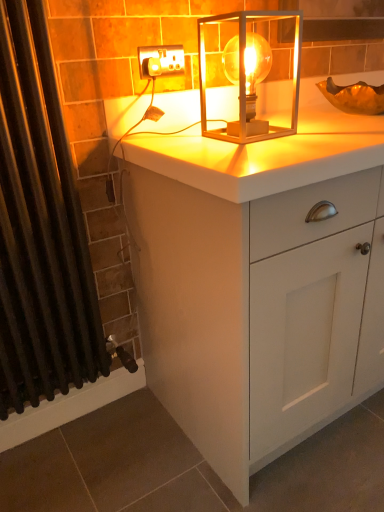
Question: Is white matte cabinet at center positioned beyond the bounds of white plastic socket at upper center?

Choices:
 (A) no
 (B) yes

Answer: (B)

Question: Considering the relative sizes of white matte cabinet at center and white plastic socket at upper center in the image provided, is white matte cabinet at center shorter than white plastic socket at upper center?

Choices:
 (A) yes
 (B) no

Answer: (B)

Question: Considering the relative sizes of white matte cabinet at center and white plastic socket at upper center in the image provided, is white matte cabinet at center wider than white plastic socket at upper center?

Choices:
 (A) yes
 (B) no

Answer: (A)

Question: Are white matte cabinet at center and white plastic socket at upper center located far from each other?

Choices:
 (A) yes
 (B) no

Answer: (B)

Question: From a real-world perspective, is white matte cabinet at center under white plastic socket at upper center?

Choices:
 (A) yes
 (B) no

Answer: (A)

Question: From the image's perspective, is white matte cabinet at center located above or below black fabric shower curtain at left?

Choices:
 (A) above
 (B) below

Answer: (B)

Question: In terms of size, does white matte cabinet at center appear bigger or smaller than black fabric shower curtain at left?

Choices:
 (A) small
 (B) big

Answer: (B)

Question: In the image, is white matte cabinet at center positioned in front of or behind black fabric shower curtain at left?

Choices:
 (A) front
 (B) behind

Answer: (B)

Question: Is white matte cabinet at center taller or shorter than black fabric shower curtain at left?

Choices:
 (A) short
 (B) tall

Answer: (A)

Question: From the image's perspective, relative to white matte cabinet at center, is white plastic socket at upper center above or below?

Choices:
 (A) above
 (B) below

Answer: (A)

Question: Is white plastic socket at upper center situated inside white matte cabinet at center or outside?

Choices:
 (A) inside
 (B) outside

Answer: (B)

Question: Considering their positions, is white plastic socket at upper center located in front of or behind white matte cabinet at center?

Choices:
 (A) front
 (B) behind

Answer: (B)

Question: Is white plastic socket at upper center bigger or smaller than white matte cabinet at center?

Choices:
 (A) big
 (B) small

Answer: (B)

Question: In the image, is black fabric shower curtain at left positioned in front of or behind white plastic socket at upper center?

Choices:
 (A) front
 (B) behind

Answer: (A)

Question: Is black fabric shower curtain at left wider or thinner than white plastic socket at upper center?

Choices:
 (A) thin
 (B) wide

Answer: (B)